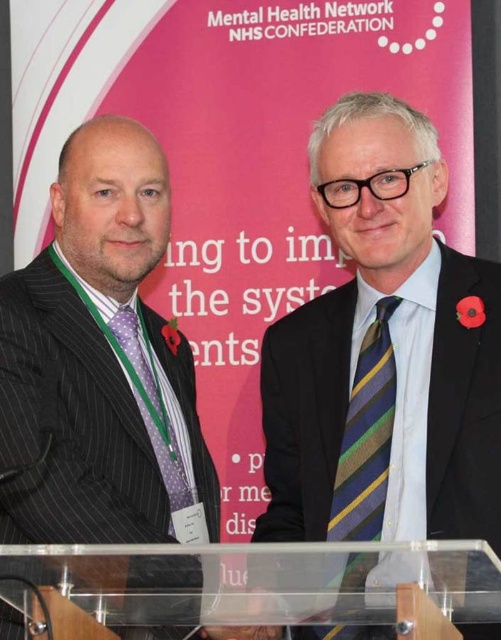
Question: Considering the real-world distances, which object is closest to the polka dot silk tie at left?

Choices:
 (A) striped silk tie at center
 (B) striped wool tie at center

Answer: (B)

Question: Which object is closer to the camera taking this photo?

Choices:
 (A) striped silk tie at center
 (B) striped wool tie at center
 (C) polka dot silk tie at left

Answer: (A)

Question: Is striped silk tie at center behind polka dot silk tie at left?

Choices:
 (A) yes
 (B) no

Answer: (B)

Question: Is black pinstripe suit at left wider than striped wool tie at center?

Choices:
 (A) no
 (B) yes

Answer: (B)

Question: Is black pinstripe suit at left positioned in front of striped silk tie at center?

Choices:
 (A) no
 (B) yes

Answer: (B)

Question: Which of the following is the closest to the observer?

Choices:
 (A) striped silk tie at center
 (B) polka dot silk tie at left
 (C) black pinstripe suit at left
 (D) striped wool tie at center

Answer: (C)